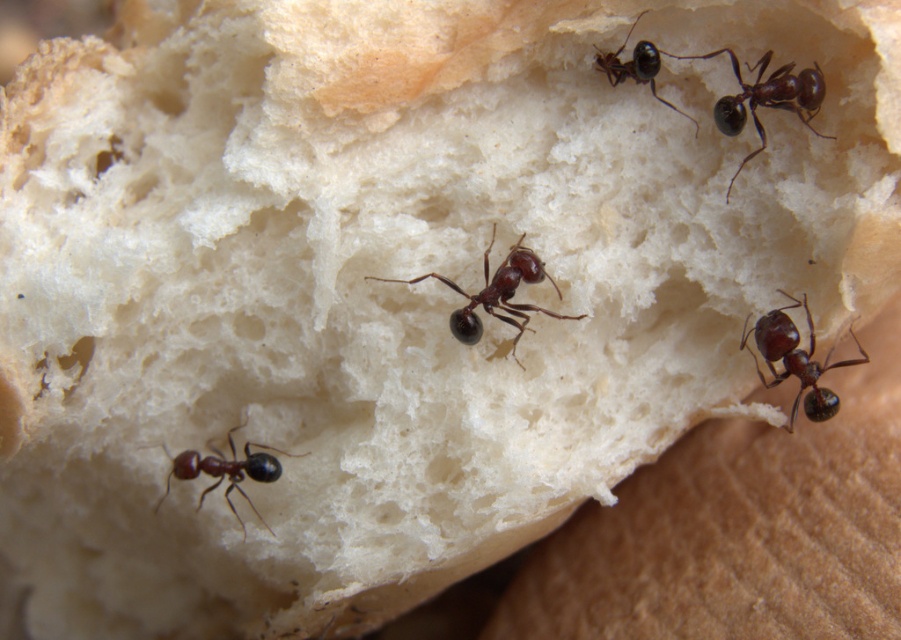
You are an exterminator trying to locate ants on a piece of bread. You see a shiny black ant at lower left and a shiny dark brown ant at upper center. Which ant is positioned to the left of the other?

The shiny black ant at lower left is positioned on the left side of the shiny dark brown ant at upper center.

In the scene shown: You are a scientist observing ants on a bread slice. You notice two ants labeled as shiny dark brown ant at upper right and shiny dark brown ant at center. Which of these two ants is smaller in width?

The shiny dark brown ant at upper right is smaller in width compared to the shiny dark brown ant at center.

You are an ant explorer trying to navigate the bread surface. You see a shiny dark brown ant at center and a shiny black ant at lower left. Which ant is closer to the top edge of the bread?

The shiny dark brown ant at center is taller than the shiny black ant at lower left, so it is closer to the top edge of the bread.